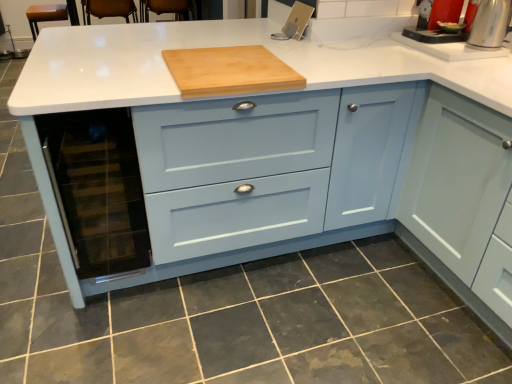
Locate an element on the screen. The width and height of the screenshot is (512, 384). dark gray tile at lower center is located at coordinates (243, 322).

Locate an element on the screen. satin silver kettle at upper right is located at coordinates (490, 24).

Is satin silver kettle at upper right to the left or to the right of white glossy sink at upper right in the image?

Clearly, satin silver kettle at upper right is on the right of white glossy sink at upper right in the image.

Is point (483, 31) farther from viewer compared to point (414, 37)?

No, it is not.

Image resolution: width=512 pixels, height=384 pixels. Find the location of `sink to the left of satin silver kettle at upper right`. sink to the left of satin silver kettle at upper right is located at coordinates (450, 33).

Is satin silver kettle at upper right oriented towards white glossy sink at upper right?

No, satin silver kettle at upper right is not aimed at white glossy sink at upper right.

Considering the sizes of objects natural wood cutting board at center and satin silver kettle at upper right in the image provided, who is bigger, natural wood cutting board at center or satin silver kettle at upper right?

natural wood cutting board at center is bigger.

Find the location of a particular element. The height and width of the screenshot is (384, 512). home appliance above the natural wood cutting board at center (from the image's perspective) is located at coordinates (490, 24).

Is natural wood cutting board at center at the right side of satin silver kettle at upper right?

Incorrect, natural wood cutting board at center is not on the right side of satin silver kettle at upper right.

Would you say natural wood cutting board at center is inside or outside satin silver kettle at upper right?

natural wood cutting board at center is spatially situated outside satin silver kettle at upper right.

From the image's perspective, which is below, white glossy sink at upper right or dark gray tile at lower center?

dark gray tile at lower center.

Find the location of a particular element. sink lying behind the dark gray tile at lower center is located at coordinates 450,33.

How different are the orientations of white glossy sink at upper right and dark gray tile at lower center in degrees?

They differ by 91.9 degrees in their facing directions.

From a real-world perspective, does transparent glass wine cooler at lower left sit lower than dark gray tile at lower center?

No, from a real-world perspective, transparent glass wine cooler at lower left is not below dark gray tile at lower center.

In the image, is transparent glass wine cooler at lower left positioned in front of or behind dark gray tile at lower center?

Clearly, transparent glass wine cooler at lower left is behind dark gray tile at lower center.

Is point (78, 222) farther from viewer compared to point (267, 314)?

That is False.

Can you confirm if natural wood cutting board at center is wider than white glossy sink at upper right?

Correct, the width of natural wood cutting board at center exceeds that of white glossy sink at upper right.

Does point (221, 80) appear closer or farther from the camera than point (433, 30)?

Point (221, 80) is closer to the camera than point (433, 30).

Considering the relative positions of natural wood cutting board at center and white glossy sink at upper right in the image provided, is natural wood cutting board at center to the left of white glossy sink at upper right from the viewer's perspective?

Indeed, natural wood cutting board at center is positioned on the left side of white glossy sink at upper right.

Can you confirm if natural wood cutting board at center is taller than white glossy sink at upper right?

No, natural wood cutting board at center is not taller than white glossy sink at upper right.

Is transparent glass wine cooler at lower left completely or partially inside dark gray tile at lower center?

Definitely not — transparent glass wine cooler at lower left is not inside dark gray tile at lower center.

From a real-world perspective, who is located higher, dark gray tile at lower center or transparent glass wine cooler at lower left?

From a 3D spatial view, transparent glass wine cooler at lower left is above.

From the picture: Considering the relative positions of dark gray tile at lower center and transparent glass wine cooler at lower left in the image provided, is dark gray tile at lower center to the left or to the right of transparent glass wine cooler at lower left?

From the image, it's evident that dark gray tile at lower center is to the right of transparent glass wine cooler at lower left.

Which object is further away from the camera taking this photo, dark gray tile at lower center or transparent glass wine cooler at lower left?

transparent glass wine cooler at lower left is further from the camera.

Would you consider transparent glass wine cooler at lower left to be distant from natural wood cutting board at center?

No, there isn't a large distance between transparent glass wine cooler at lower left and natural wood cutting board at center.

In the image, is transparent glass wine cooler at lower left on the left side or the right side of natural wood cutting board at center?

Clearly, transparent glass wine cooler at lower left is on the left of natural wood cutting board at center in the image.

Where is `home appliance on the right of the white glossy sink at upper right`? This screenshot has height=384, width=512. home appliance on the right of the white glossy sink at upper right is located at coordinates (490, 24).

Locate an element on the screen. kitchen appliance below the satin silver kettle at upper right (from the image's perspective) is located at coordinates pos(229,71).

When comparing their distances from white glossy sink at upper right, does dark gray tile at lower center or satin silver kettle at upper right seem further?

Among the two, dark gray tile at lower center is located further to white glossy sink at upper right.

Looking at the image, which one is located closer to dark gray tile at lower center, natural wood cutting board at center or white glossy sink at upper right?

natural wood cutting board at center.

Looking at the image, which one is located further to dark gray tile at lower center, satin silver kettle at upper right or white glossy sink at upper right?

The object further to dark gray tile at lower center is satin silver kettle at upper right.

When comparing their distances from natural wood cutting board at center, does dark gray tile at lower center or transparent glass wine cooler at lower left seem closer?

transparent glass wine cooler at lower left.

Based on their spatial positions, is dark gray tile at lower center or white glossy sink at upper right closer to natural wood cutting board at center?

Among the two, white glossy sink at upper right is located nearer to natural wood cutting board at center.

Estimate the real-world distances between objects in this image. Which object is closer to dark gray tile at lower center, natural wood cutting board at center or transparent glass wine cooler at lower left?

The object closer to dark gray tile at lower center is transparent glass wine cooler at lower left.

Which object lies further to the anchor point dark gray tile at lower center, white glossy sink at upper right or satin silver kettle at upper right?

satin silver kettle at upper right is positioned further to the anchor dark gray tile at lower center.

Which object lies nearer to the anchor point transparent glass wine cooler at lower left, white glossy sink at upper right or natural wood cutting board at center?

natural wood cutting board at center is positioned closer to the anchor transparent glass wine cooler at lower left.

Image resolution: width=512 pixels, height=384 pixels. I want to click on home appliance between white glossy sink at upper right and dark gray tile at lower center vertically, so click(x=490, y=24).

You are a GUI agent. You are given a task and a screenshot of the screen. Output one action in this format:
    pyautogui.click(x=<x>, y=<y>)
    Task: Click on the kitchen appliance located between transparent glass wine cooler at lower left and satin silver kettle at upper right in the left-right direction
    The image size is (512, 384).
    Given the screenshot: What is the action you would take?
    pyautogui.click(x=229, y=71)

Where is `appliance that lies between natural wood cutting board at center and dark gray tile at lower center from top to bottom`? Image resolution: width=512 pixels, height=384 pixels. appliance that lies between natural wood cutting board at center and dark gray tile at lower center from top to bottom is located at coordinates (97, 189).

In order to click on tile between transparent glass wine cooler at lower left and white glossy sink at upper right in this screenshot , I will do `click(243, 322)`.